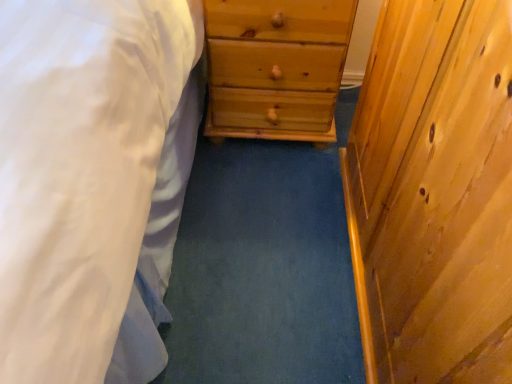
Where is `light brown wooden chest of drawers at center`? light brown wooden chest of drawers at center is located at coordinates click(x=276, y=67).

This screenshot has width=512, height=384. What do you see at coordinates (276, 67) in the screenshot?
I see `light brown wooden chest of drawers at center` at bounding box center [276, 67].

Image resolution: width=512 pixels, height=384 pixels. I want to click on light brown wooden chest of drawers at center, so click(x=276, y=67).